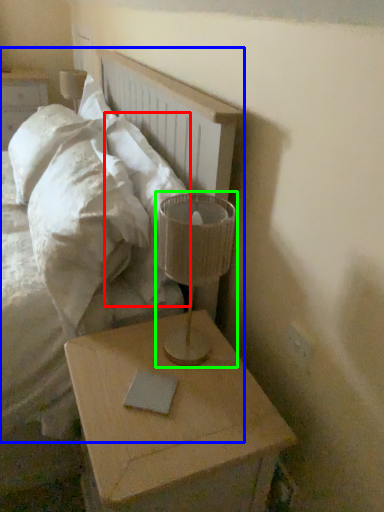
Question: Which object is positioned closest to pillow (highlighted by a red box)? Select from bed (highlighted by a blue box) and table lamp (highlighted by a green box).

Choices:
 (A) bed
 (B) table lamp

Answer: (A)